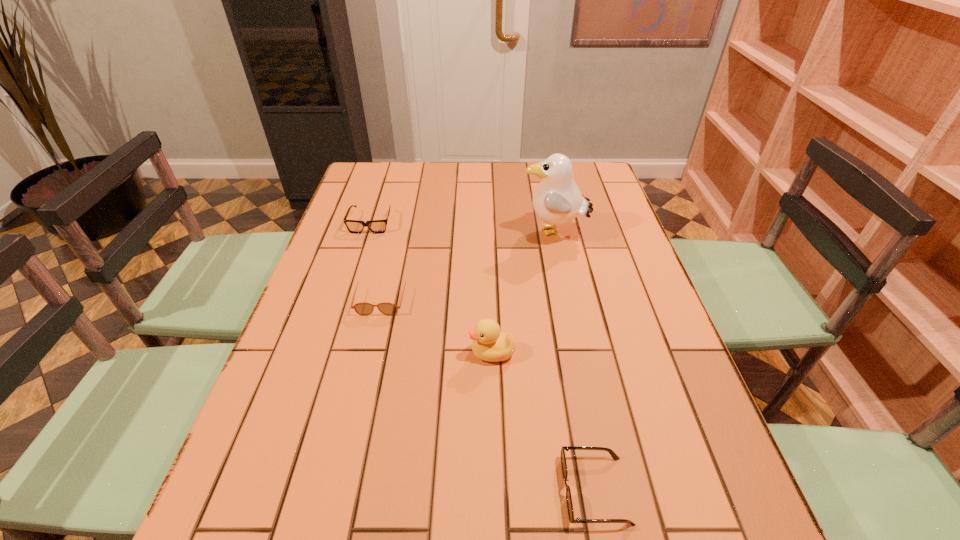
What are the coordinates of `vacant space at the far edge of the desktop` in the screenshot? It's located at (460, 167).

In the image, there is a desktop. Where is `vacant region at the left edge`? vacant region at the left edge is located at coordinates [319, 299].

Where is `free space at the right edge`? The width and height of the screenshot is (960, 540). free space at the right edge is located at coordinates (699, 433).

The height and width of the screenshot is (540, 960). In order to click on vacant space at the far left corner of the desktop in this screenshot , I will do `click(399, 170)`.

Find the location of `vacant space at the far right corner of the desktop`. vacant space at the far right corner of the desktop is located at coordinates (573, 173).

The image size is (960, 540). Find the location of `vacant area between the third farthest object and the duckling`. vacant area between the third farthest object and the duckling is located at coordinates (437, 325).

Where is `vacant region between the gull and the rightmost sunglasses`? The height and width of the screenshot is (540, 960). vacant region between the gull and the rightmost sunglasses is located at coordinates (574, 361).

Identify the location of vacant point located between the fourth shortest object and the third farthest object. Image resolution: width=960 pixels, height=540 pixels. (437, 325).

The width and height of the screenshot is (960, 540). I want to click on empty location between the gull and the nearest sunglasses, so click(574, 361).

I want to click on free space between the farthest sunglasses and the second farthest sunglasses, so click(x=376, y=260).